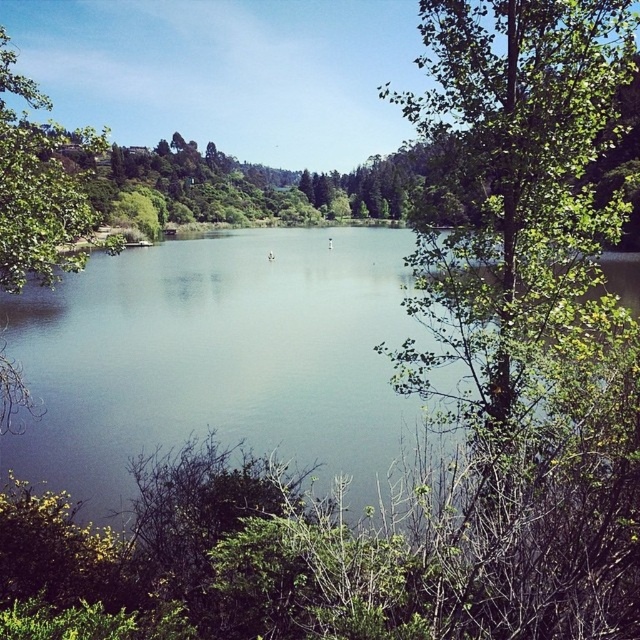
You are standing at the center of the image and want to locate the green leafy tree at right. According to the coordinates provided, in which direction should you look to find it?

The green leafy tree at right is located at coordinates point (513, 189), so you should look to the right side of the image to find it.

You are standing at the center of the lakeside and want to walk towards the green leafy tree at right and the green leafy tree at upper left. Which direction should you face to walk towards the tree that is further to your right?

You should face towards the right direction to walk towards the green leafy tree at right, since it is positioned to the right of the green leafy tree at upper left and therefore further to your right.